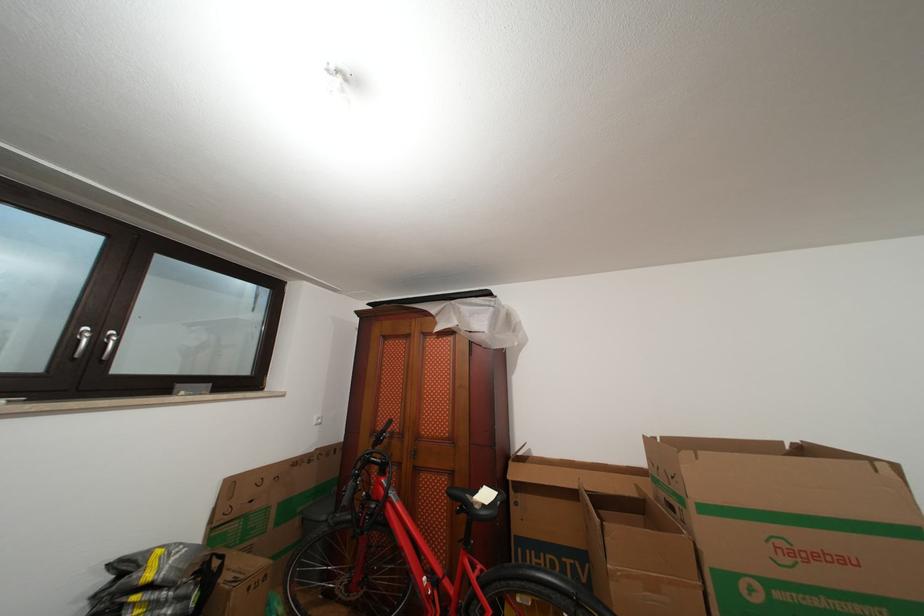
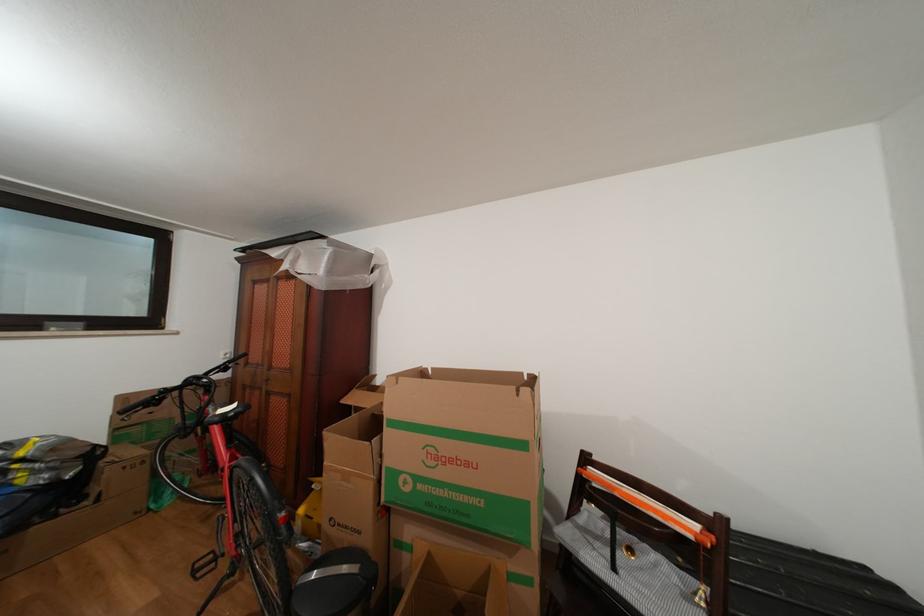
Question: What movement of the cameraman would produce the second image?

Choices:
 (A) Left
 (B) Right
 (C) Forward
 (D) Backward

Answer: (B)